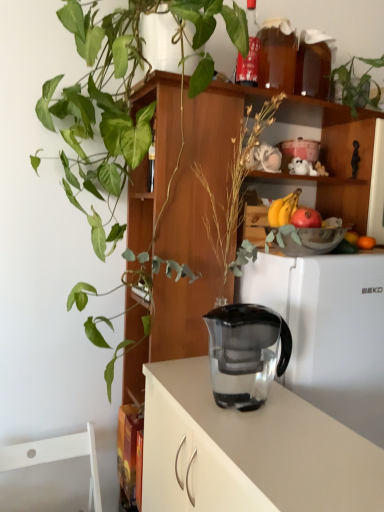
Question: Is matte glass bottle at upper center wider or thinner than green leafy plant at upper right, acting as the first houseplant starting from the right?

Choices:
 (A) thin
 (B) wide

Answer: (A)

Question: In terms of height, does matte glass bottle at upper center look taller or shorter compared to green leafy plant at upper right, the 2th houseplant positioned from the left?

Choices:
 (A) short
 (B) tall

Answer: (A)

Question: Which object is positioned closest to the matte glass bottle at upper center?

Choices:
 (A) green glossy plant at upper left, the first houseplant viewed from the left
 (B) red matte apple at upper right
 (C) transparent glass vase at center
 (D) transparent plastic jug at center
 (E) yellow matte bananas at upper right

Answer: (C)

Question: Estimate the real-world distances between objects in this image. Which object is farther from the white matte refrigerator at center?

Choices:
 (A) transparent glass vase at center
 (B) yellow matte bananas at upper right
 (C) green leafy plant at upper right, the 2th houseplant positioned from the left
 (D) matte glass bottle at upper center
 (E) red matte apple at upper right

Answer: (D)